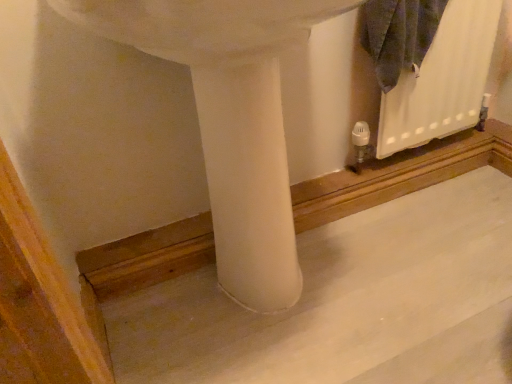
At what (x,y) coordinates should I click in order to perform the action: click on vacant space underneath white matte sink at center (from a real-world perspective). Please return your answer as a coordinate pair (x, y). This screenshot has width=512, height=384. Looking at the image, I should click on (272, 305).